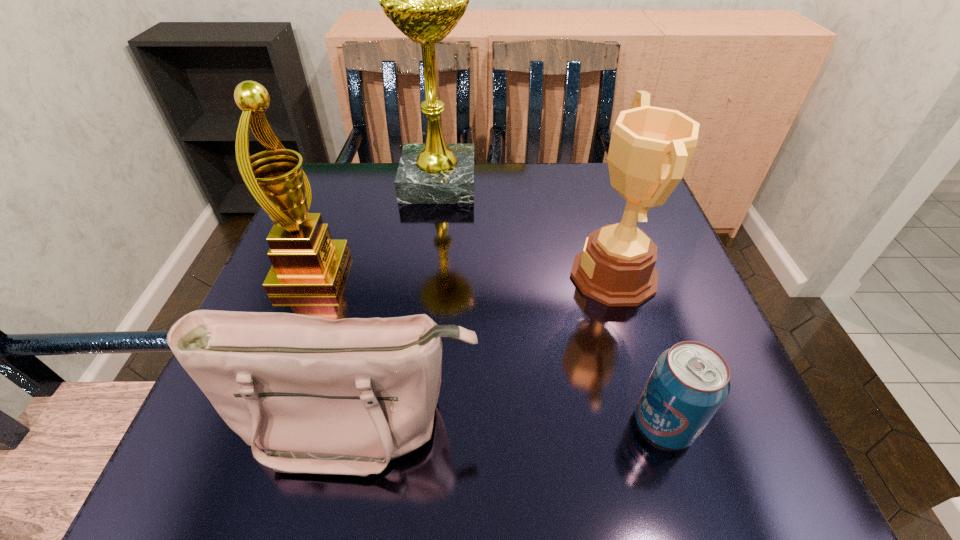
The height and width of the screenshot is (540, 960). Identify the location of blank area in the image that satisfies the following two spatial constraints: 1. on the front-facing side of the farthest award; 2. on the front pocket of the second shortest object. (410, 421).

Where is `vacant space that satisfies the following two spatial constraints: 1. on the front-facing side of the farthest object; 2. on the right side of the pop soda`? The image size is (960, 540). vacant space that satisfies the following two spatial constraints: 1. on the front-facing side of the farthest object; 2. on the right side of the pop soda is located at coordinates (409, 424).

Locate an element on the screen. Image resolution: width=960 pixels, height=540 pixels. free space that satisfies the following two spatial constraints: 1. on the front-facing side of the pop soda; 2. on the left side of the rightmost award is located at coordinates (659, 424).

Identify the location of free location that satisfies the following two spatial constraints: 1. on the front-facing side of the farthest object; 2. on the front pocket of the shoulder bag. (410, 421).

The width and height of the screenshot is (960, 540). What are the coordinates of `vacant space that satisfies the following two spatial constraints: 1. on the front pocket of the pop soda; 2. on the right side of the shoulder bag` in the screenshot? It's located at (356, 424).

Identify the location of free region that satisfies the following two spatial constraints: 1. on the back side of the pop soda; 2. on the front-facing side of the rightmost award. (617, 275).

I want to click on free space that satisfies the following two spatial constraints: 1. on the front-facing side of the shortest object; 2. on the right side of the leftmost award, so click(252, 424).

Identify the location of free spot that satisfies the following two spatial constraints: 1. on the front-facing side of the leftmost award; 2. on the left side of the shortest object. (252, 424).

At what (x,y) coordinates should I click in order to perform the action: click on vacant space that satisfies the following two spatial constraints: 1. on the front-facing side of the pop soda; 2. on the left side of the farthest object. Please return your answer as a coordinate pair (x, y). Looking at the image, I should click on (409, 424).